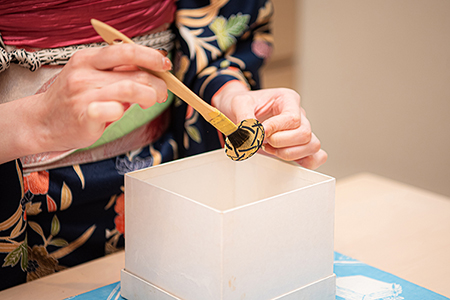
The height and width of the screenshot is (300, 450). What are the coordinates of `blue cloth` in the screenshot? It's located at (376, 275).